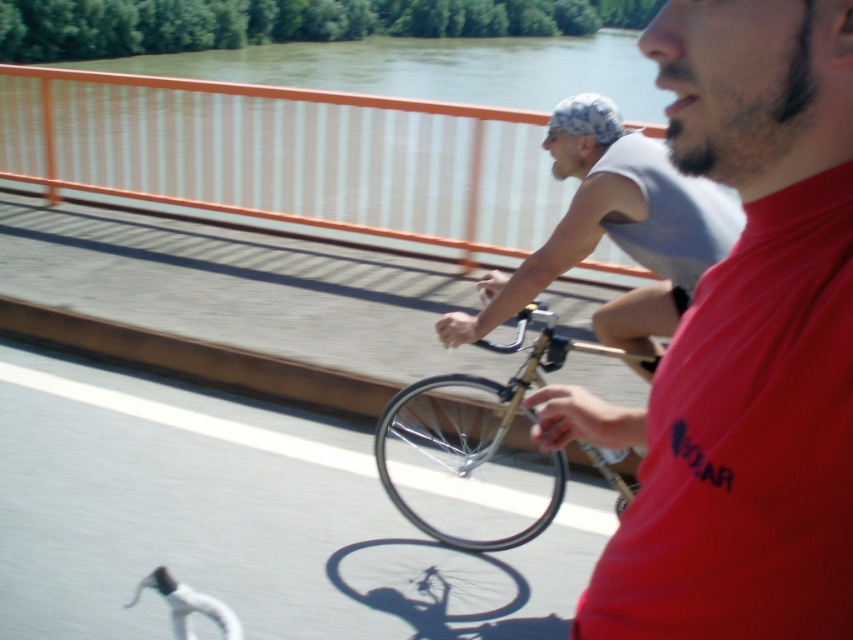
Question: Does metallic gold bike at center appear over blue fabric helmet at upper center?

Choices:
 (A) no
 (B) yes

Answer: (A)

Question: Which of the following is the closest to the observer?

Choices:
 (A) shiny metallic bicycle wheel at center
 (B) gold metallic bicycle at center

Answer: (B)

Question: Is matte red t-shirt at center below blue fabric helmet at upper center?

Choices:
 (A) no
 (B) yes

Answer: (B)

Question: From the image, what is the correct spatial relationship of metallic gold bike at center in relation to gold metallic bicycle at center?

Choices:
 (A) right
 (B) left

Answer: (B)

Question: Which point appears farthest from the camera in this image?

Choices:
 (A) (675, 422)
 (B) (412, 420)

Answer: (B)

Question: Which of the following is the closest to the observer?

Choices:
 (A) (622, 621)
 (B) (225, 552)

Answer: (A)